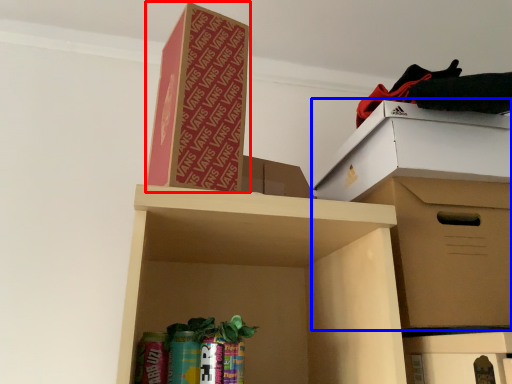
Question: Which object appears farthest to the camera in this image, cardboard box (highlighted by a red box) or cardboard box (highlighted by a blue box)?

Choices:
 (A) cardboard box
 (B) cardboard box

Answer: (B)